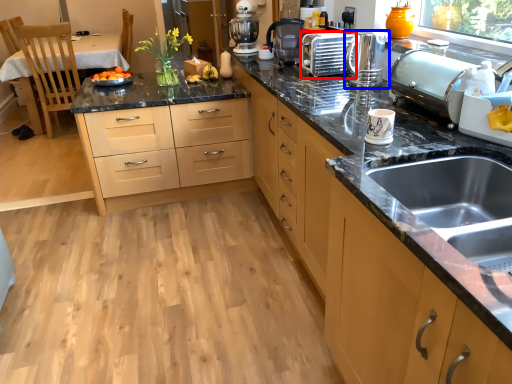
Question: Which of the following is the farthest to the observer, appliance (highlighted by a red box) or kitchen appliance (highlighted by a blue box)?

Choices:
 (A) appliance
 (B) kitchen appliance

Answer: (A)